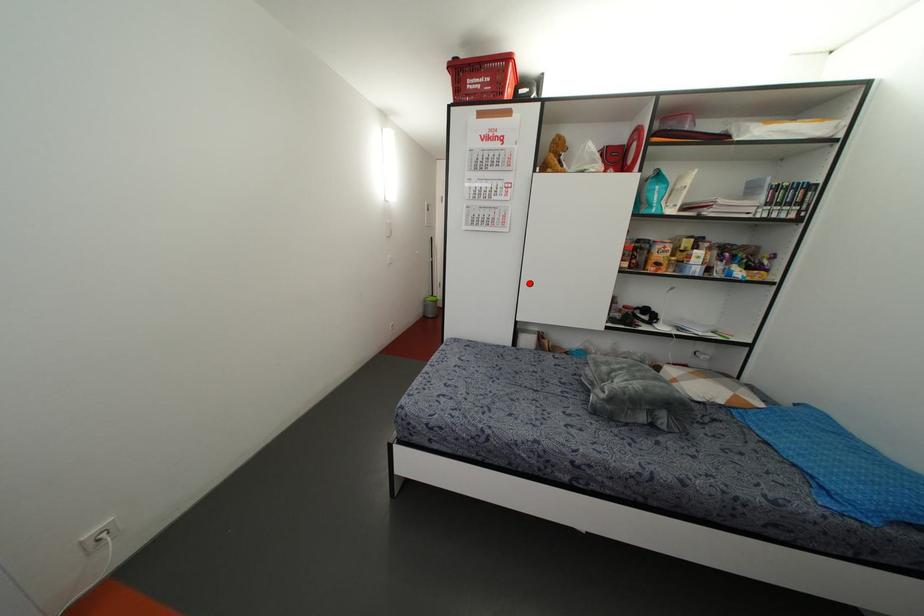
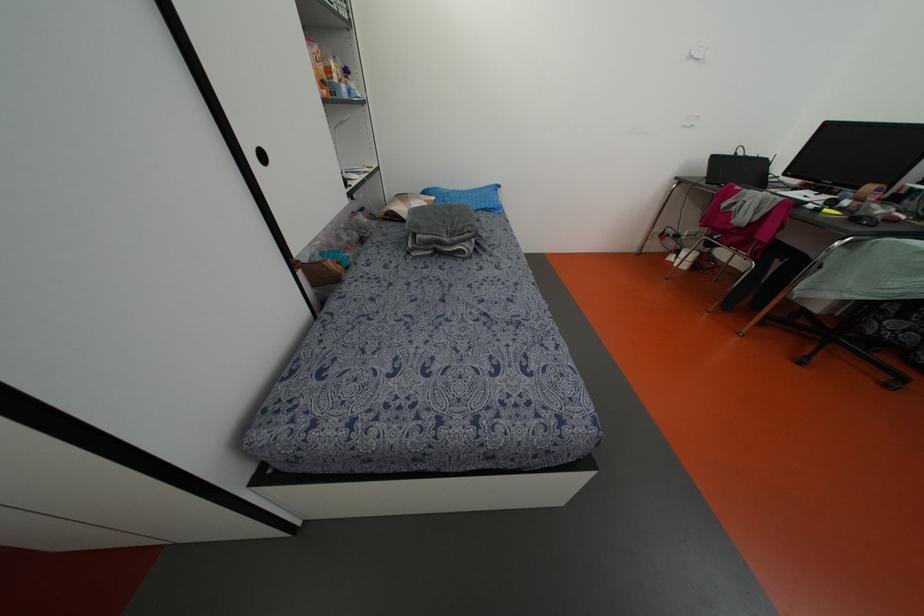
Locate, in the second image, the point that corresponds to the highlighted location in the first image.

(262, 156)